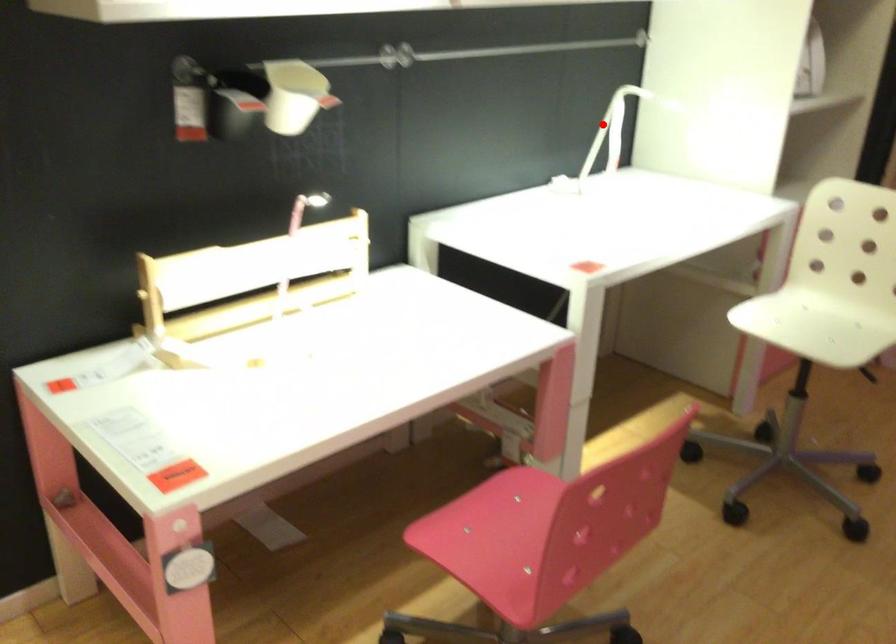
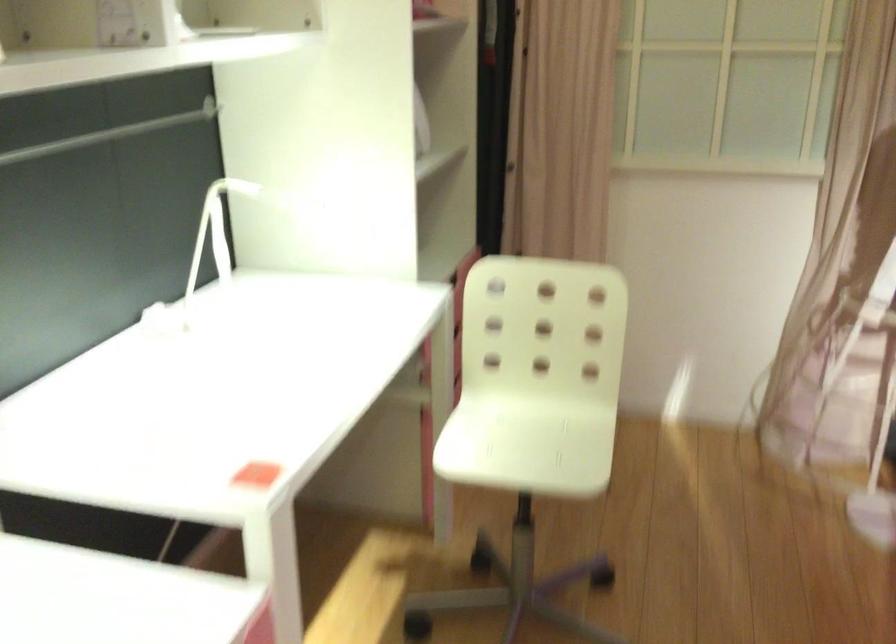
Locate, in the second image, the point that corresponds to the highlighted location in the first image.

(213, 234)